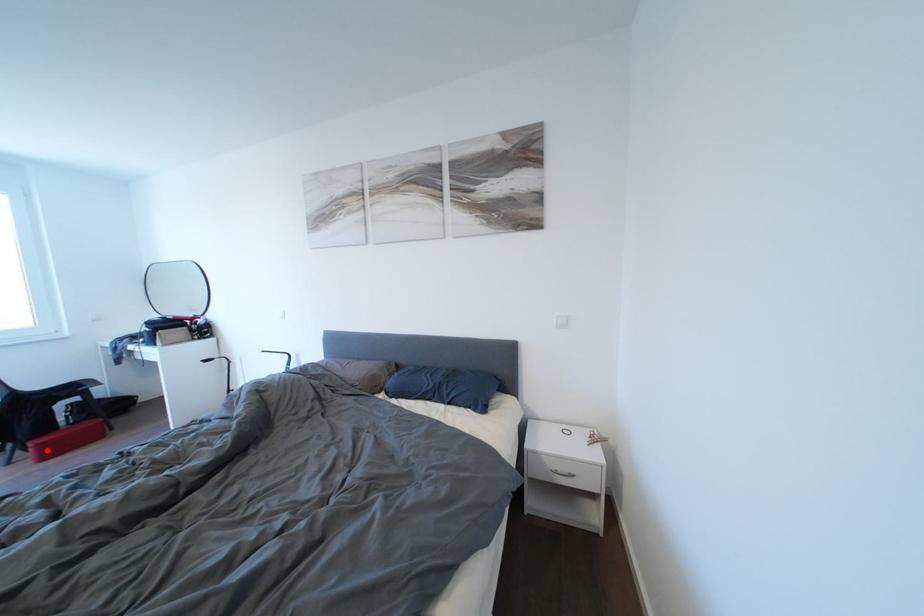
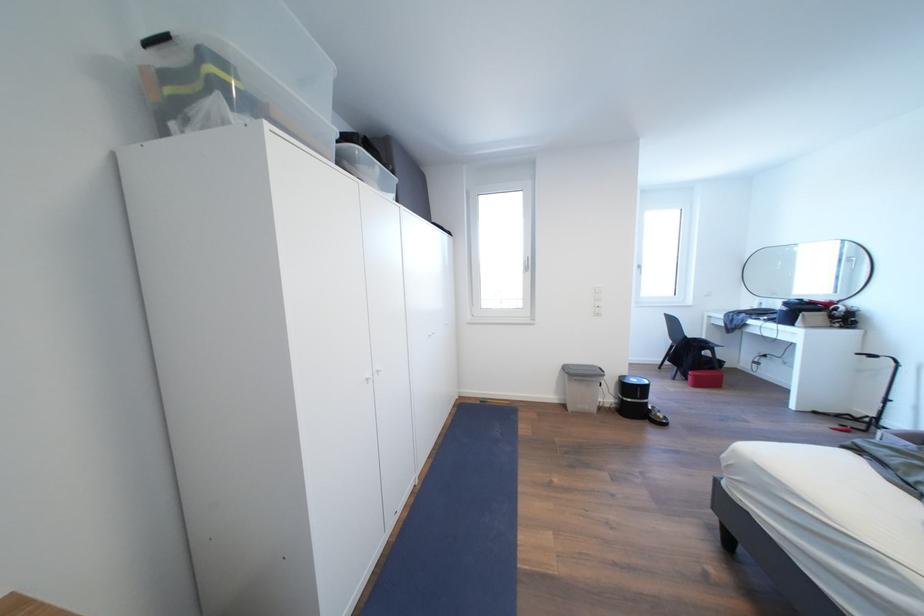
The point at the highlighted location is marked in the first image. Where is the corresponding point in the second image?

(703, 381)